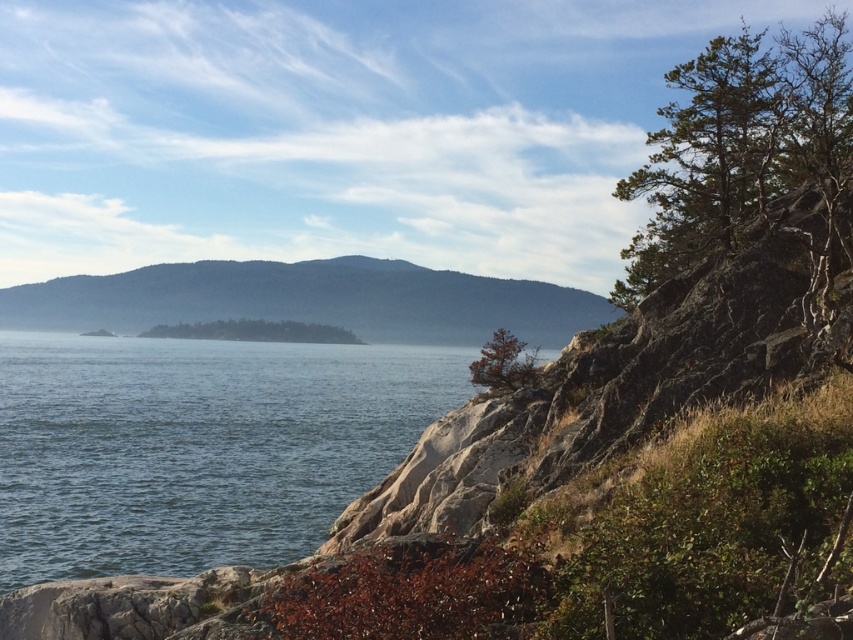
Question: Does clear water at lower left lie behind green textured rock at upper right?

Choices:
 (A) yes
 (B) no

Answer: (A)

Question: Where is clear water at lower left located in relation to green textured rock at upper right in the image?

Choices:
 (A) right
 (B) left

Answer: (B)

Question: Observing the image, what is the correct spatial positioning of green textured rock at upper right in reference to green leafy tree at center?

Choices:
 (A) above
 (B) below

Answer: (A)

Question: Which is nearer to the green matte tree at upper right?

Choices:
 (A) clear water at lower left
 (B) green leafy tree at center

Answer: (A)

Question: Which object is the farthest from the clear water at lower left?

Choices:
 (A) green leafy tree at center
 (B) gray rocky mountain at center
 (C) green textured rock at upper right
 (D) green matte tree at upper right

Answer: (B)

Question: Estimate the real-world distances between objects in this image. Which object is farther from the gray rocky mountain at center?

Choices:
 (A) green textured rock at upper right
 (B) green leafy tree at center
 (C) green matte tree at upper right

Answer: (C)